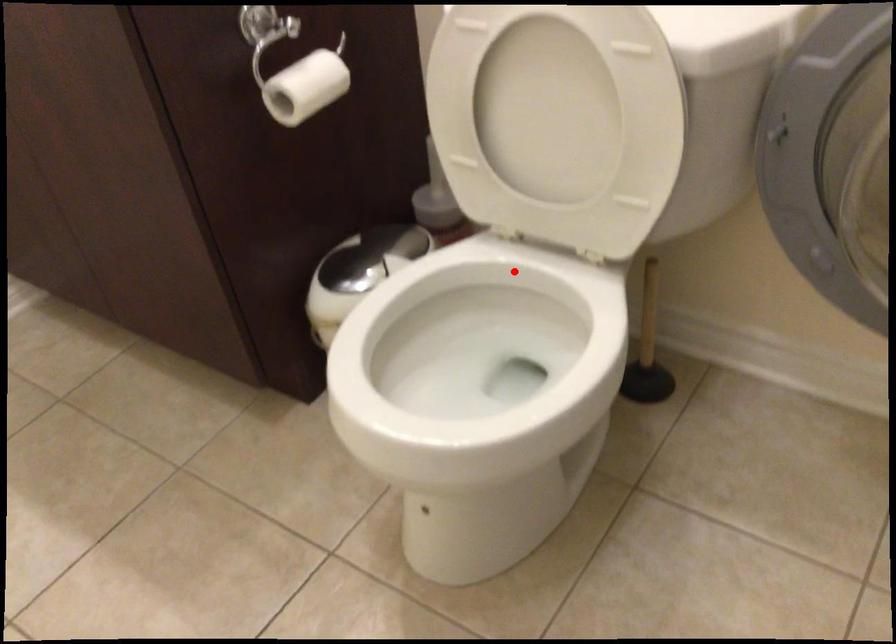
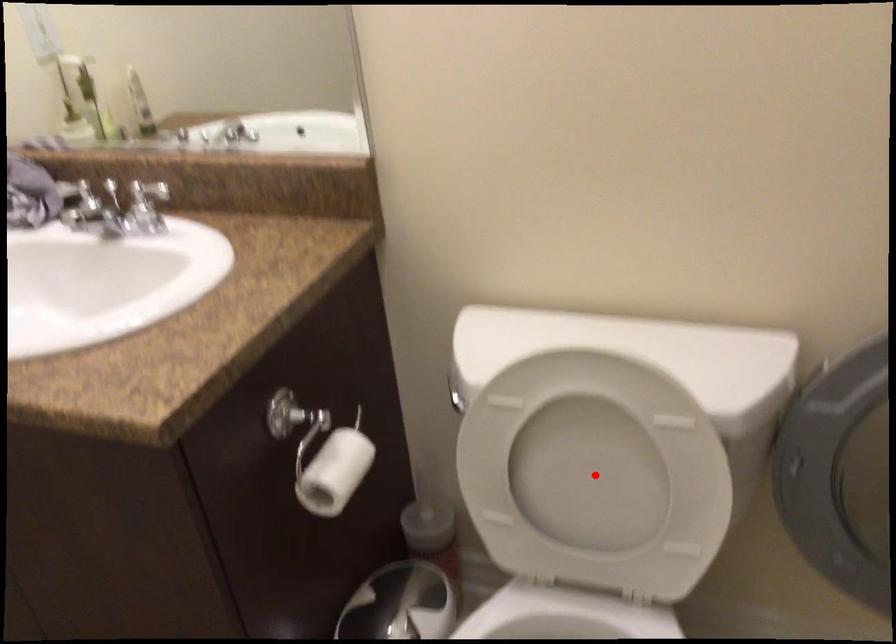
I am providing you with two images of the same scene from different viewpoints. A red point is marked on the first image and another point is marked on the second image. Is the marked point in image1 the same physical position as the marked point in image2?

No